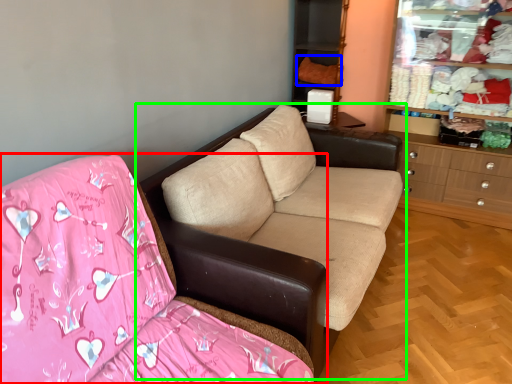
Question: Which object is positioned closest to studio couch (highlighted by a red box)? Select from clothing (highlighted by a blue box) and studio couch (highlighted by a green box).

Choices:
 (A) clothing
 (B) studio couch

Answer: (B)